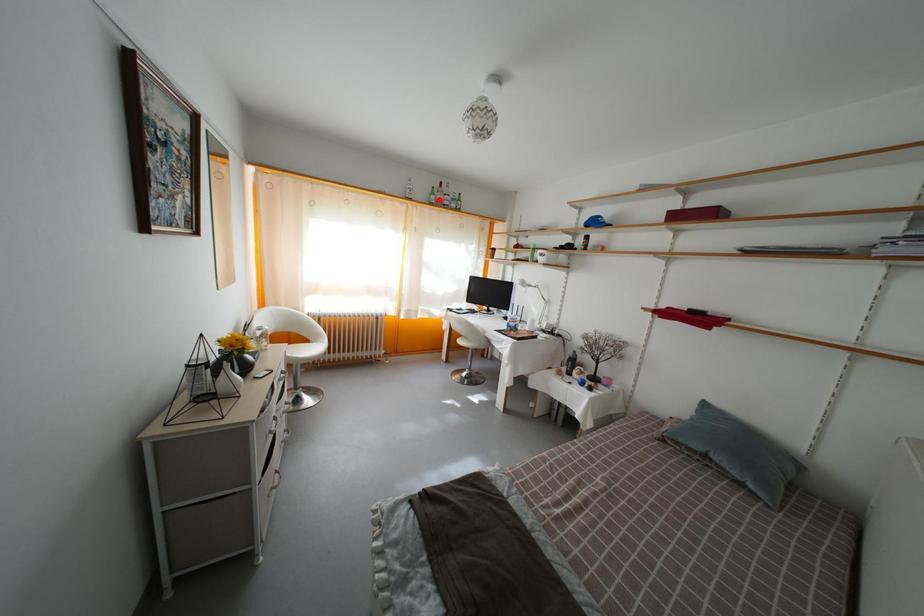
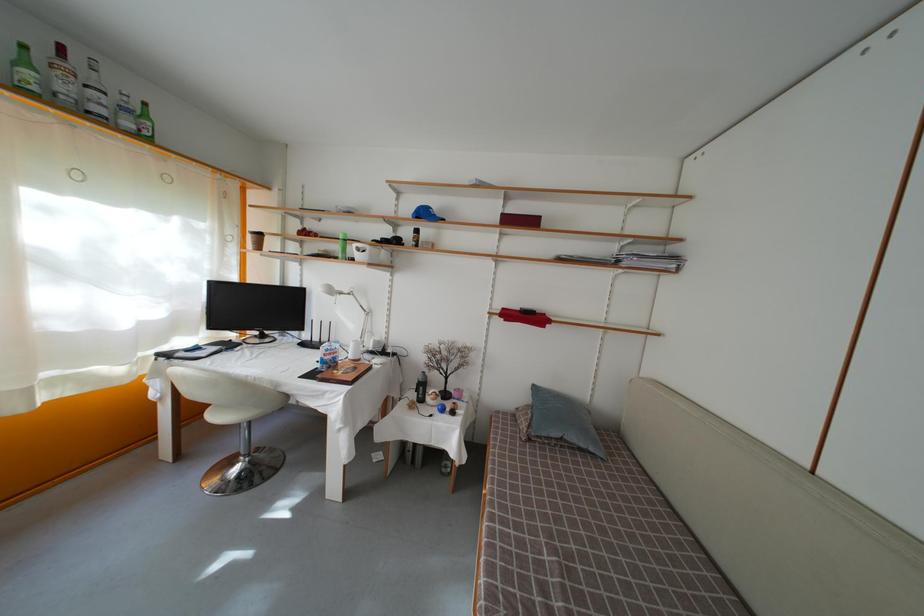
The point at the highlighted location is marked in the first image. Where is the corresponding point in the second image?

(31, 69)